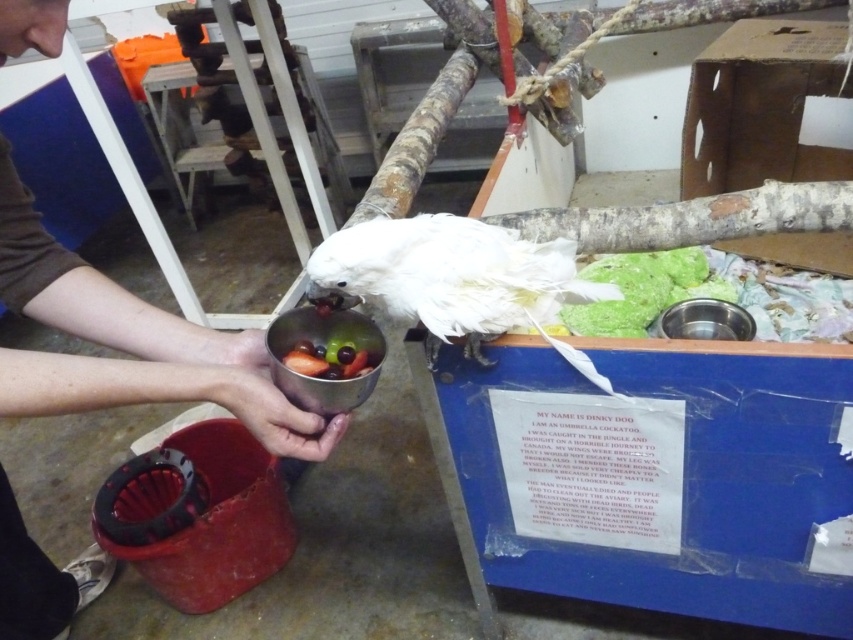
Based on the photo, you are a visitor at the zoo and want to take a photo of the white cockatoo. You notice two points marked in the image. Which point should you focus on to ensure the cockatoo is in focus? The two points are point 1 at coordinates point (x=15, y=547) and point 2 at coordinates point (x=292, y=317). Please choose between point 1 or point 2.

You should focus on point 1 at coordinates point (x=15, y=547) because it is closer to the viewer than point 2 at coordinates point (x=292, y=317), ensuring the cockatoo is in focus.

You are a zookeeper preparing to feed the white feathered bird at center. You have a feeding stick that is 60 centimeters long. Can you reach the bird without moving closer? Please explain your reasoning.

The white feathered bird at center is 71.19 centimeters away from the viewer. Since the feeding stick is only 60 centimeters long, it is not long enough to reach the bird without moving closer.

From the picture: You are a zookeeper who needs to place a new feeding tray between the metallic silver bowl at center and the matte silver cup at lower center. The tray is 2 inches wide. Will it fit without overlapping either container?

The distance between the metallic silver bowl at center and the matte silver cup at lower center is 2.26 inches. Since the tray is 2 inches wide, it will fit between them without overlapping as there is enough space.